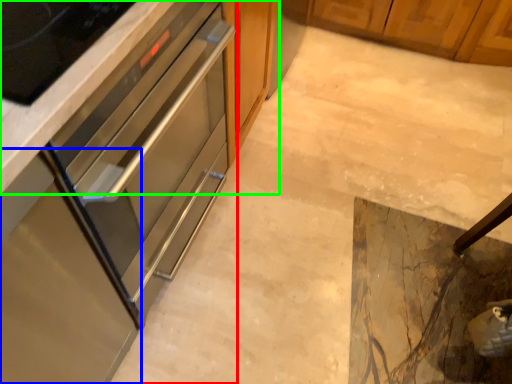
Question: Considering the real-world distances, which object is closest to cabinetry (highlighted by a red box)? cabinetry (highlighted by a blue box) or cabinetry (highlighted by a green box).

Choices:
 (A) cabinetry
 (B) cabinetry

Answer: (A)